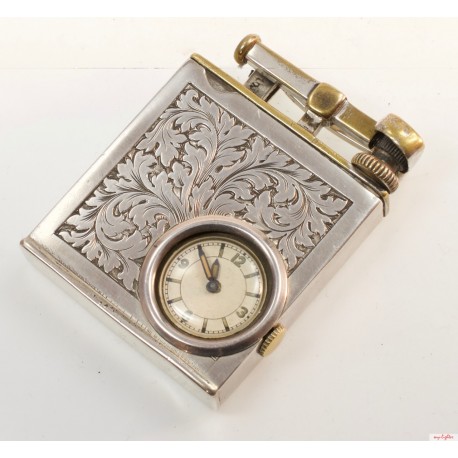
This screenshot has width=458, height=458. Find the location of `clock hands`. clock hands is located at coordinates (202, 260), (215, 267).